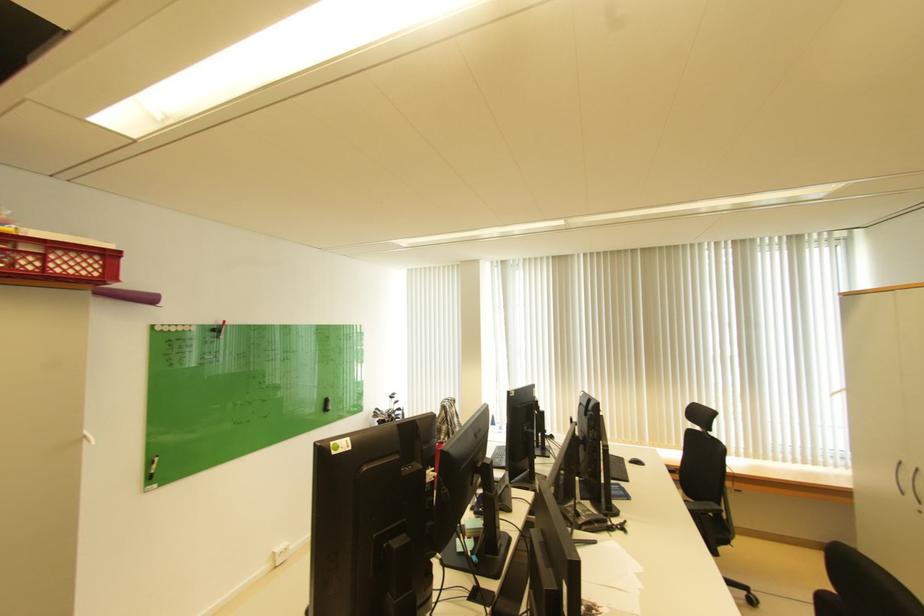
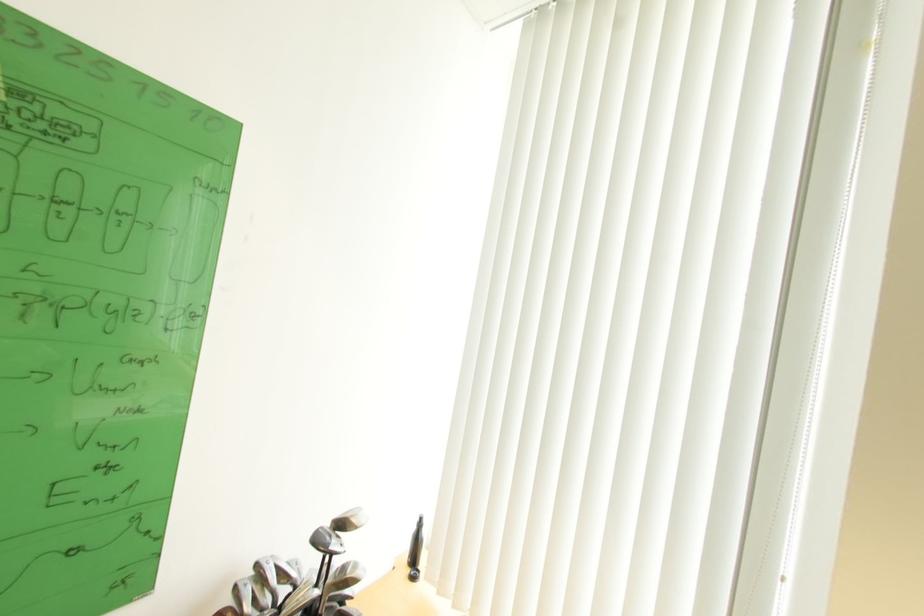
Question: The images are taken continuously from a first-person perspective. In which direction are you moving?

Choices:
 (A) Left
 (B) Right
 (C) Forward
 (D) Backward

Answer: (C)